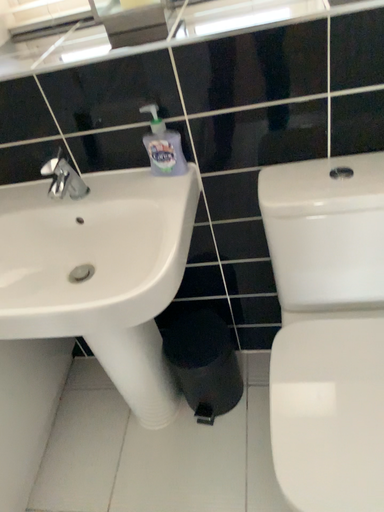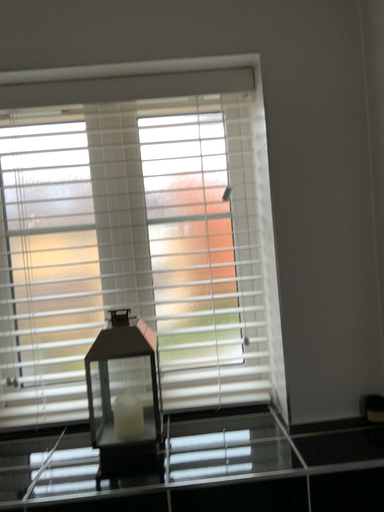
Question: How did the camera likely rotate when shooting the video?

Choices:
 (A) rotated upward
 (B) rotated downward

Answer: (A)